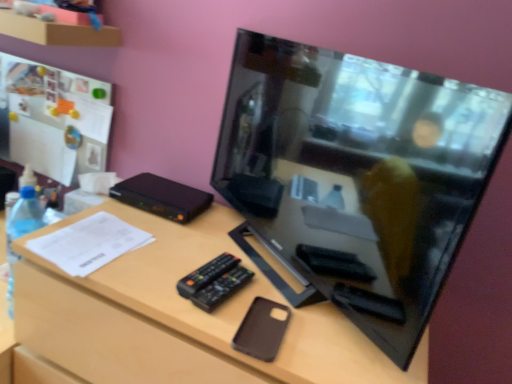
At what (x,y) coordinates should I click in order to perform the action: click on free space that is in between black plastic remote at center and brown matte phone case at center. Please return your answer as a coordinate pair (x, y). This screenshot has height=384, width=512. Looking at the image, I should click on (238, 309).